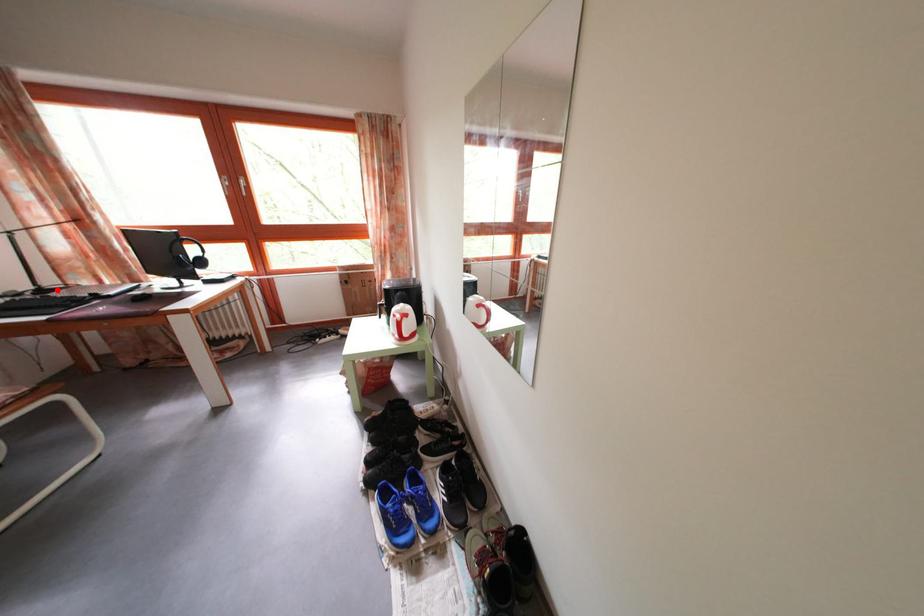
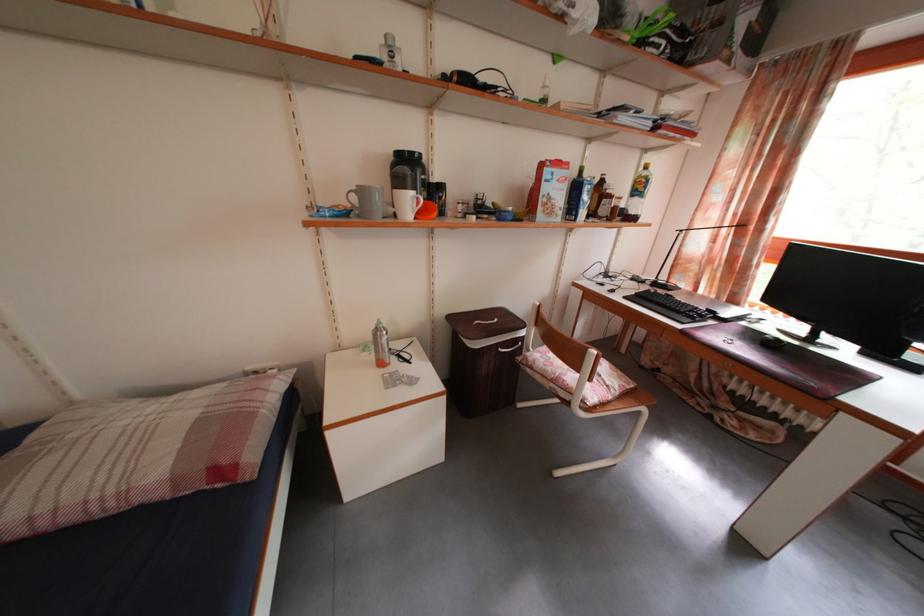
Where in the second image is the point corresponding to the highlighted location from the first image?

(671, 285)